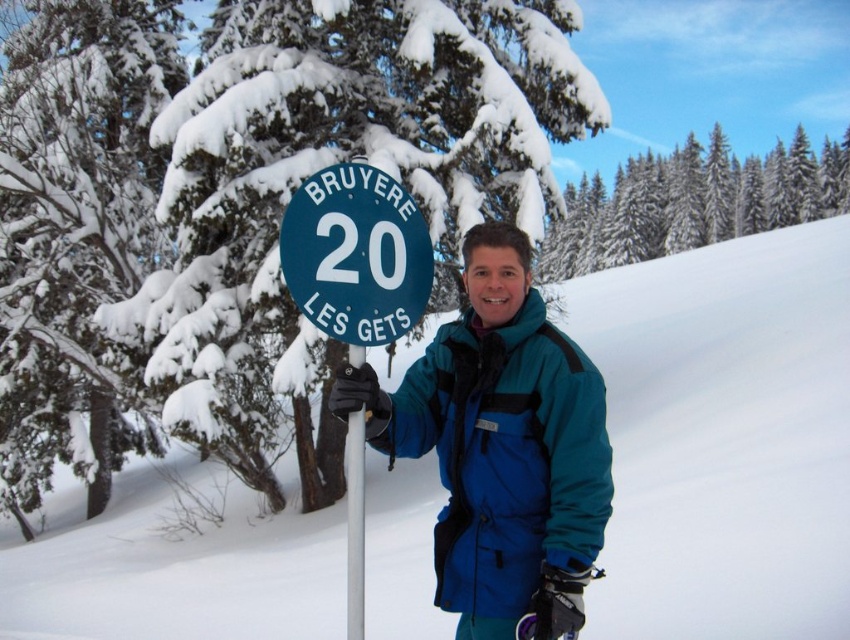
Question: Does black rubber ski pole at center have a smaller size compared to matte black ski at lower center?

Choices:
 (A) yes
 (B) no

Answer: (B)

Question: Can you confirm if snow-covered evergreen at left is positioned above blue synthetic jacket at center?

Choices:
 (A) yes
 (B) no

Answer: (B)

Question: Which point is farther from the camera taking this photo?

Choices:
 (A) click(420, 259)
 (B) click(360, 552)
 (C) click(491, 236)

Answer: (A)

Question: Considering the real-world distances, which object is farthest from the snow-covered evergreen at left?

Choices:
 (A) green snow-covered trees at upper center
 (B) black rubber ski pole at center

Answer: (A)

Question: Which object is farther from the camera taking this photo?

Choices:
 (A) green plastic sign at center
 (B) blue synthetic jacket at center

Answer: (A)

Question: Is the position of green plastic sign at center less distant than that of matte black ski at lower center?

Choices:
 (A) yes
 (B) no

Answer: (B)